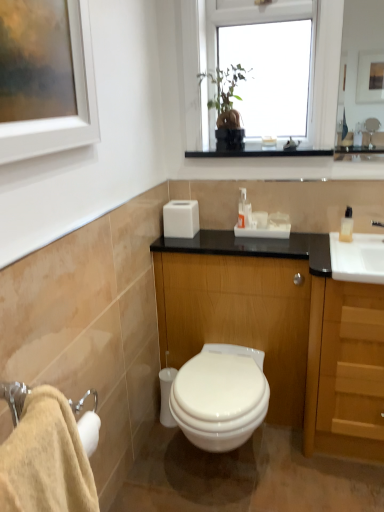
At what (x,y) coordinates should I click in order to perform the action: click on vacant point above white glossy toilet at center (from a real-world perspective). Please return your answer as a coordinate pair (x, y). Looking at the image, I should click on (211, 375).